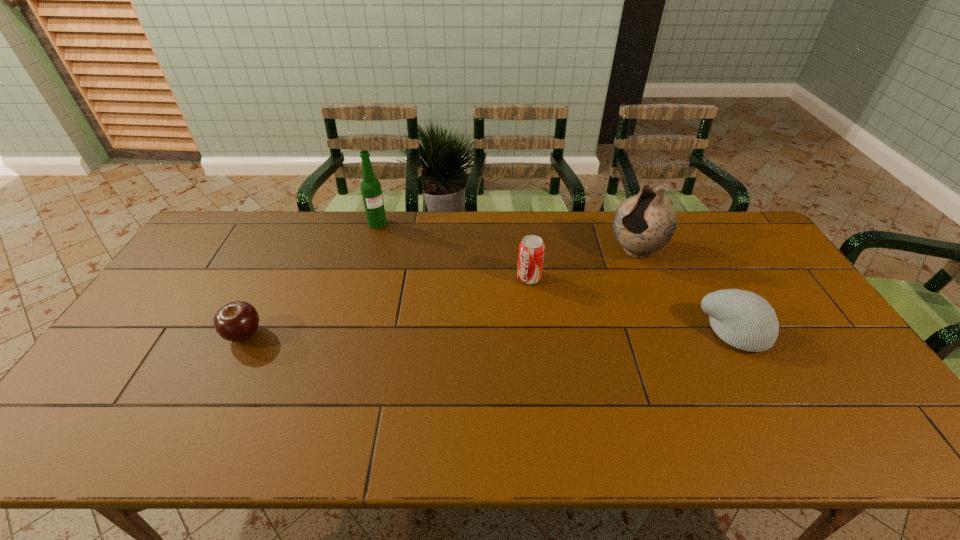
At what (x,y) coordinates should I click in order to perform the action: click on free area in between the beanie and the third farthest object. Please return your answer as a coordinate pair (x, y). The width and height of the screenshot is (960, 540). Looking at the image, I should click on (632, 305).

Identify the location of vacant area that lies between the fourth object from right to left and the beanie. (557, 278).

Where is `free spot between the beanie and the apple`? free spot between the beanie and the apple is located at coordinates (490, 333).

Identify the location of vacant space that is in between the soda can and the apple. This screenshot has height=540, width=960. (387, 306).

Image resolution: width=960 pixels, height=540 pixels. I want to click on free space between the pottery and the apple, so click(x=440, y=293).

Locate an element on the screen. The width and height of the screenshot is (960, 540). empty space between the beanie and the third nearest object is located at coordinates (x=632, y=305).

Where is `free space that is in between the beanie and the leftmost object`? The width and height of the screenshot is (960, 540). free space that is in between the beanie and the leftmost object is located at coordinates (490, 333).

The image size is (960, 540). Identify the location of object that is the fourth closest to the pottery. (237, 321).

Locate which object ranks fourth in proximity to the farthest object. Please provide its 2D coordinates. Your answer should be formatted as a tuple, i.e. [(x, y)], where the tuple contains the x and y coordinates of a point satisfying the conditions above.

[(743, 319)]